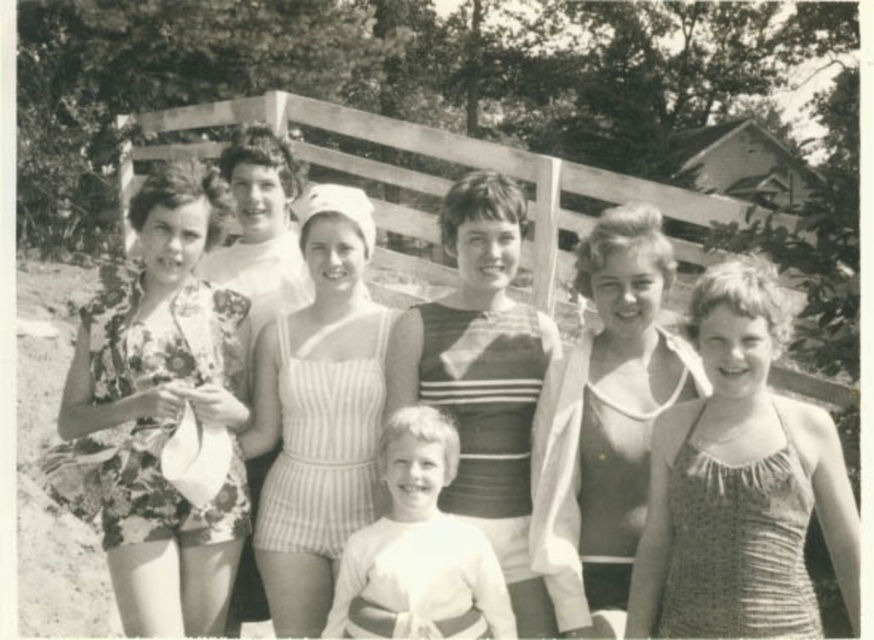
Based on the scene described, which object is shorter in height between the polka dot fabric swimsuit at center and the floral fabric dress at left?

The polka dot fabric swimsuit at center is shorter in height compared to the floral fabric dress at left.